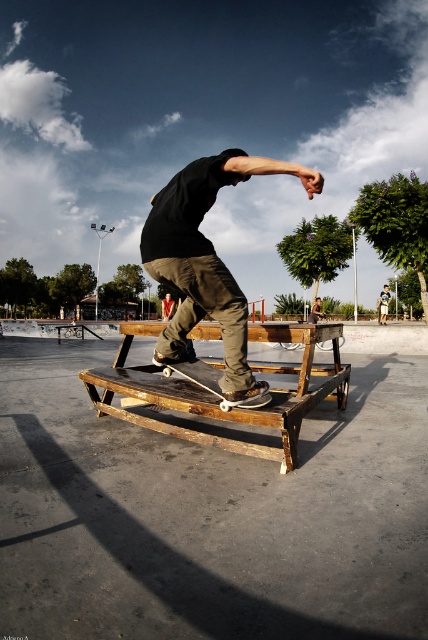
Is wooden bench at center closer to camera compared to white plastic skateboard at center?

Yes, it is in front of white plastic skateboard at center.

Does wooden bench at center have a smaller size compared to white plastic skateboard at center?

No.

Does point (269, 337) lie in front of point (186, 365)?

Yes.

This screenshot has width=428, height=640. I want to click on wooden bench at center, so click(x=217, y=397).

Does matte black skateboard at center have a larger size compared to white plastic skateboard at center?

Yes, matte black skateboard at center is bigger than white plastic skateboard at center.

Based on the photo, measure the distance between matte black skateboard at center and white plastic skateboard at center.

The distance of matte black skateboard at center from white plastic skateboard at center is 16.69 inches.

This screenshot has width=428, height=640. I want to click on matte black skateboard at center, so click(x=205, y=260).

Which is below, matte black skateboard at center or wooden bench at center?

wooden bench at center is lower down.

Who is positioned more to the right, matte black skateboard at center or wooden bench at center?

wooden bench at center

Find the location of a particular element. This screenshot has height=640, width=428. matte black skateboard at center is located at coordinates (205, 260).